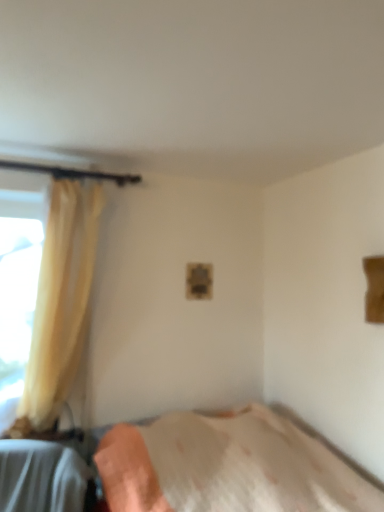
Question: In terms of size, does yellow fabric curtain at left appear bigger or smaller than white textured bed at lower center?

Choices:
 (A) big
 (B) small

Answer: (B)

Question: Is point (46, 301) positioned closer to the camera than point (221, 497)?

Choices:
 (A) farther
 (B) closer

Answer: (A)

Question: Based on their positions, is yellow fabric curtain at left located to the left or right of white textured bed at lower center?

Choices:
 (A) right
 (B) left

Answer: (B)

Question: In terms of height, does white textured bed at lower center look taller or shorter compared to yellow fabric curtain at left?

Choices:
 (A) short
 (B) tall

Answer: (A)

Question: Looking at their shapes, would you say white textured bed at lower center is wider or thinner than yellow fabric curtain at left?

Choices:
 (A) wide
 (B) thin

Answer: (A)

Question: In the image, is white textured bed at lower center positioned in front of or behind yellow fabric curtain at left?

Choices:
 (A) behind
 (B) front

Answer: (B)

Question: From the image's perspective, is white textured bed at lower center above or below yellow fabric curtain at left?

Choices:
 (A) above
 (B) below

Answer: (B)